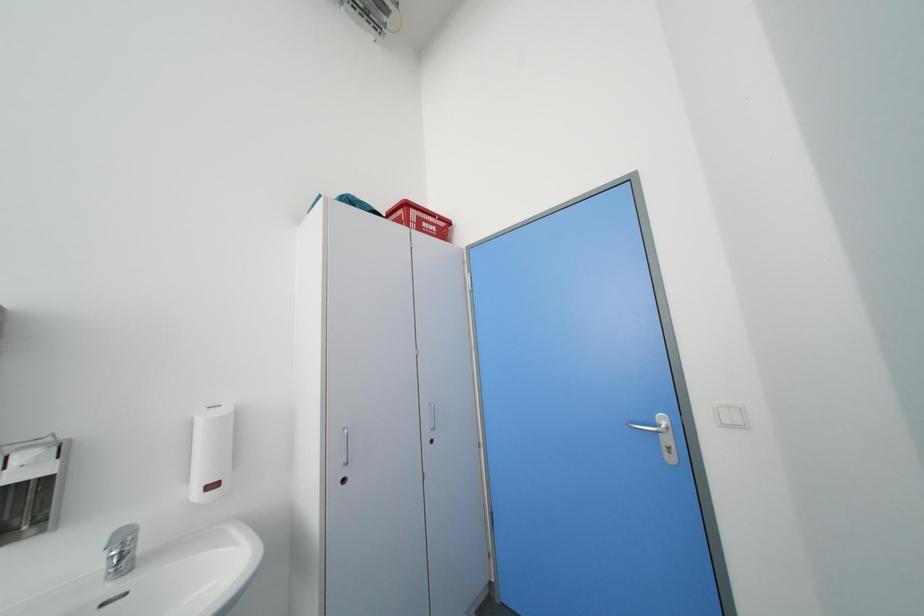
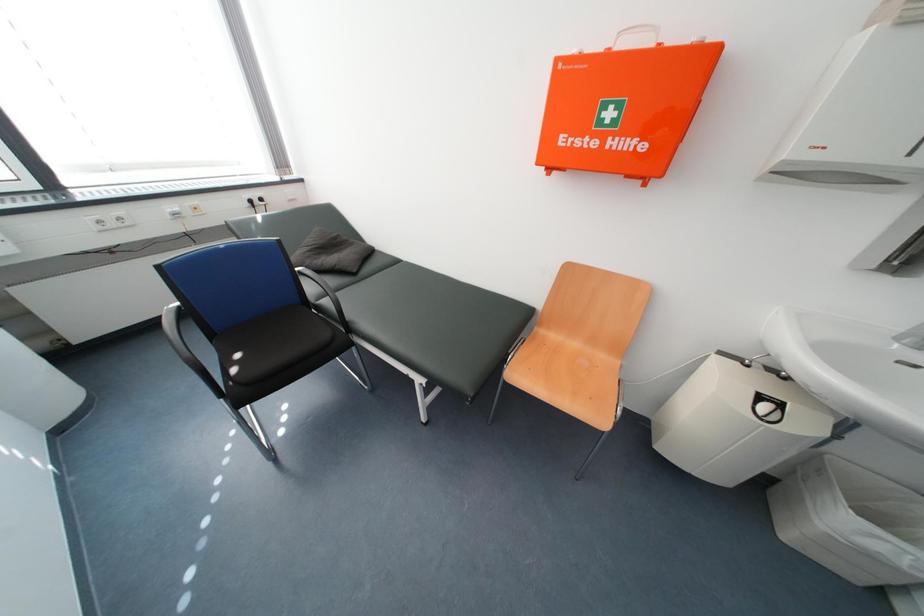
The images are taken continuously from a first-person perspective. In which direction is your viewpoint rotating?

The rotation direction of the camera is left-down.